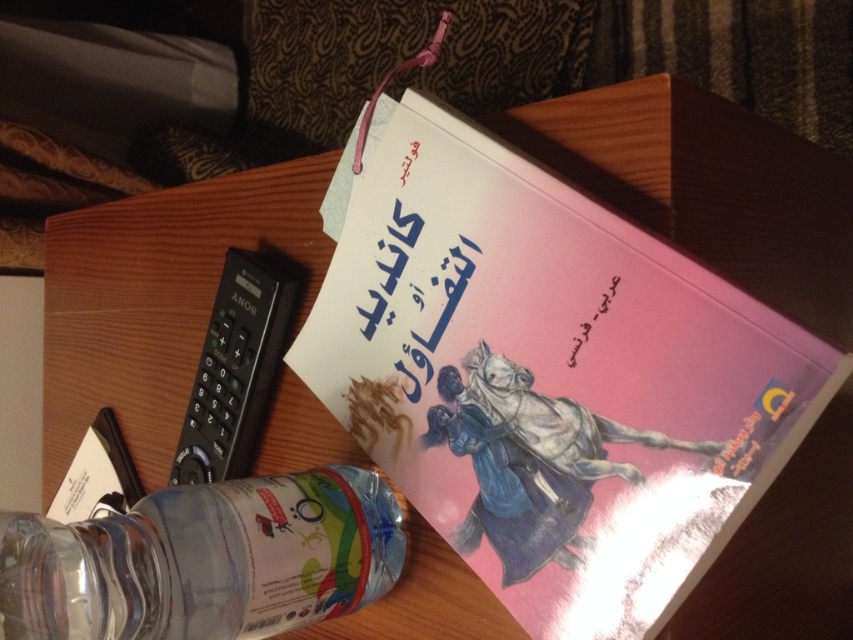
Who is taller, pink matte book at upper center or clear plastic bottle at lower left?

Standing taller between the two is pink matte book at upper center.

Who is positioned more to the left, pink matte book at upper center or clear plastic bottle at lower left?

From the viewer's perspective, clear plastic bottle at lower left appears more on the left side.

Does point (561, 376) lie in front of point (55, 557)?

No, (561, 376) is behind (55, 557).

What are the coordinates of `pink matte book at upper center` in the screenshot? It's located at (550, 380).

Does black plastic remote at left have a lesser height compared to pink matte book at center?

No.

Who is more distant from viewer, (248, 422) or (460, 272)?

Point (248, 422)

Measure the distance between black plastic remote at left and camera.

21.52 inches

Identify the location of black plastic remote at left. (234, 369).

Image resolution: width=853 pixels, height=640 pixels. Describe the element at coordinates (550, 380) in the screenshot. I see `pink matte book at upper center` at that location.

Is point (666, 314) closer to viewer compared to point (259, 301)?

Yes, point (666, 314) is closer to viewer.

Find the location of a particular element. pink matte book at upper center is located at coordinates (550, 380).